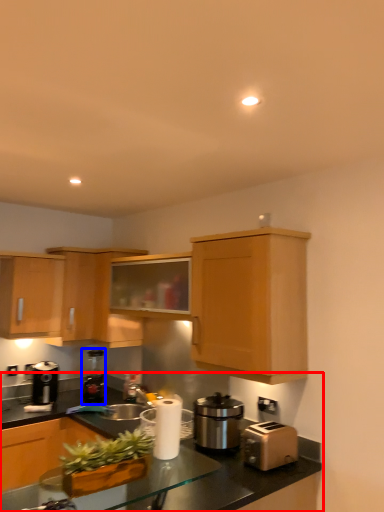
Question: Among these objects, which one is farthest to the camera, countertop (highlighted by a red box) or coffee machine (highlighted by a blue box)?

Choices:
 (A) countertop
 (B) coffee machine

Answer: (B)